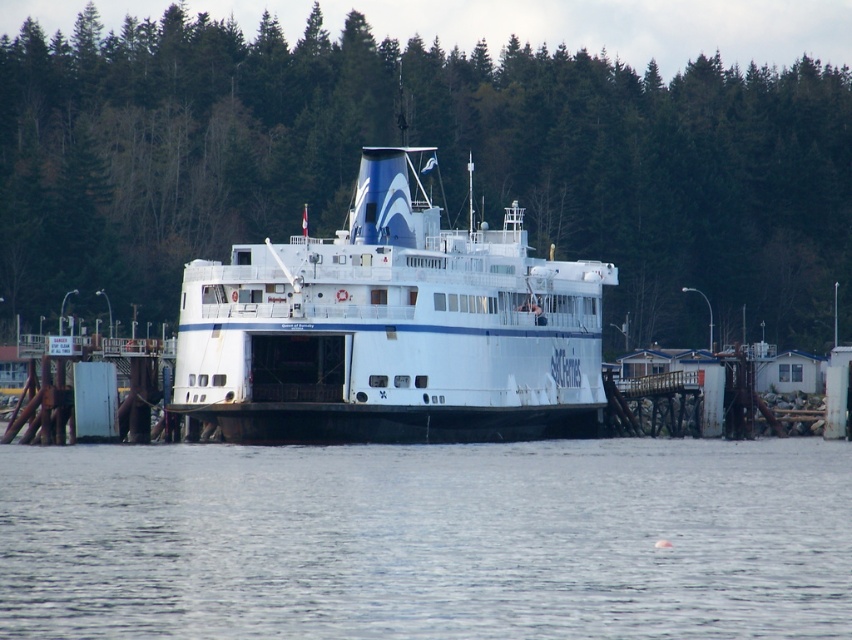
Question: In this image, where is clear water at center located relative to white matte ferry at center?

Choices:
 (A) left
 (B) right

Answer: (A)

Question: Which of the following is the farthest from the observer?

Choices:
 (A) white matte ferry at center
 (B) clear water at center
 (C) green leafy trees at upper center

Answer: (C)

Question: Which object is farther from the camera taking this photo?

Choices:
 (A) clear water at center
 (B) green leafy trees at upper center

Answer: (B)

Question: Which of the following is the farthest from the observer?

Choices:
 (A) (585, 529)
 (B) (551, 81)

Answer: (B)

Question: Is clear water at center above white matte ferry at center?

Choices:
 (A) yes
 (B) no

Answer: (B)

Question: Does clear water at center have a lesser width compared to white matte ferry at center?

Choices:
 (A) yes
 (B) no

Answer: (B)